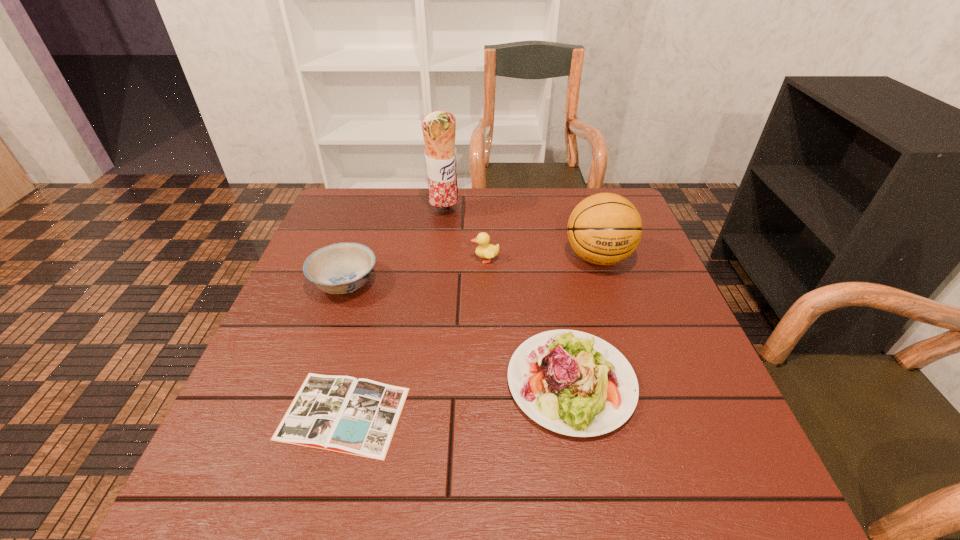
Identify the location of the tallest object. (439, 127).

Where is `burrito`? The height and width of the screenshot is (540, 960). burrito is located at coordinates (439, 127).

Identify the location of basketball. (604, 229).

Locate an element on the screen. The image size is (960, 540). duckling is located at coordinates (484, 250).

The height and width of the screenshot is (540, 960). Identify the location of the fourth shortest object. (484, 250).

Locate an element on the screen. the fourth tallest object is located at coordinates (341, 268).

Where is `the second shortest object`? Image resolution: width=960 pixels, height=540 pixels. the second shortest object is located at coordinates (571, 382).

This screenshot has height=540, width=960. What are the coordinates of `the shortest object` in the screenshot? It's located at (338, 413).

Identify the location of vacant space located 0.130m on the left of the burrito. This screenshot has height=540, width=960. (386, 212).

This screenshot has width=960, height=540. What are the coordinates of `free space located on the surface of the second tallest object near the brand logo` in the screenshot? It's located at (630, 357).